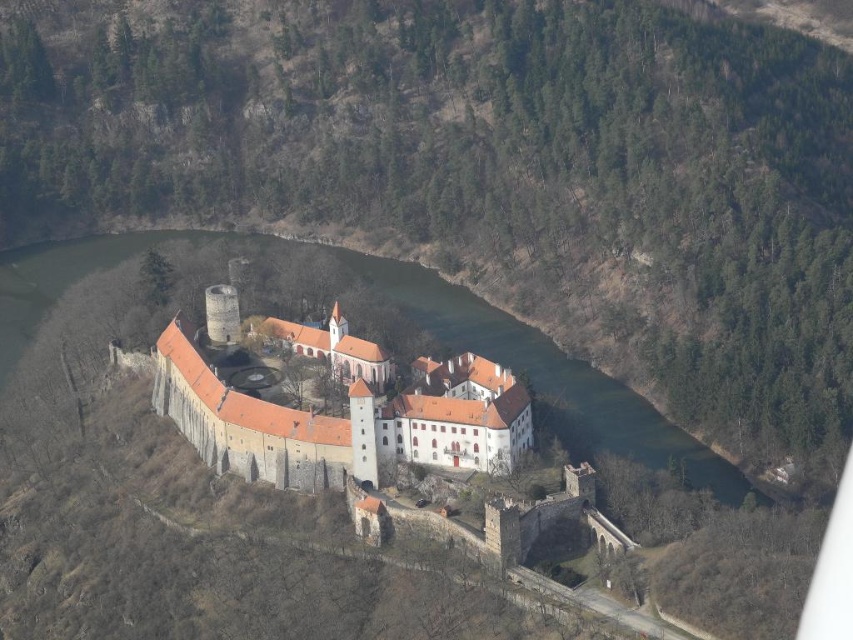
Between brown stone castle at center and green water at center, which one appears on the left side from the viewer's perspective?

brown stone castle at center is more to the left.

Find the location of a particular element. This screenshot has height=640, width=853. brown stone castle at center is located at coordinates (335, 417).